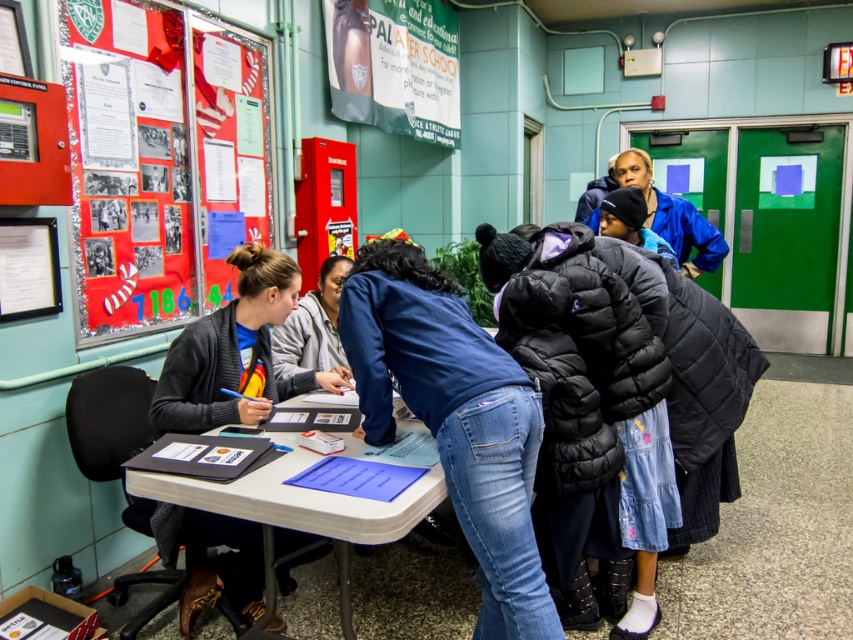
You are organizing a small event and need to place a 1.2 meter wide banner on the table. Given the dark gray sweater at left and the white plastic table at lower left, can the banner fit on the table?

The dark gray sweater at left is narrower than the white plastic table at lower left. Since the table is wider than the sweater, and the banner is 1.2 meters wide, it depends on the table width. However, the sweater being narrower than the table implies the table is at least wider than the sweater. Without exact measurements, we can infer the table might be wide enough if the sweater is smaller than 1.2m. But since the sweater is narrower than the table, if the sweater is, say, 1 meter wide, the table could

You are a visitor entering the school and see the dark gray sweater at left and the white plastic table at lower left. Which object is closer to you as you enter?

The dark gray sweater at left is closer to you because it is further to the viewer than the white plastic table at lower left.

You are a visitor at the school and need to find the bulletin board with the candy cane decorations. You see the blue denim jeans at center and the matte paper poster at upper center. Which object is closer to the left side of the bulletin board?

The matte paper poster at upper center is closer to the left side of the bulletin board because the blue denim jeans at center is positioned on the right side of it.